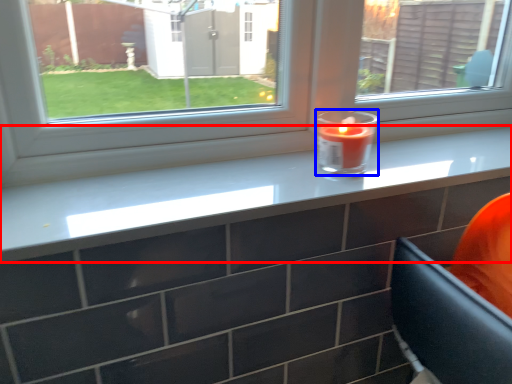
Question: Which point is further to the camera, counter top (highlighted by a red box) or birthday candle (highlighted by a blue box)?

Choices:
 (A) counter top
 (B) birthday candle

Answer: (B)